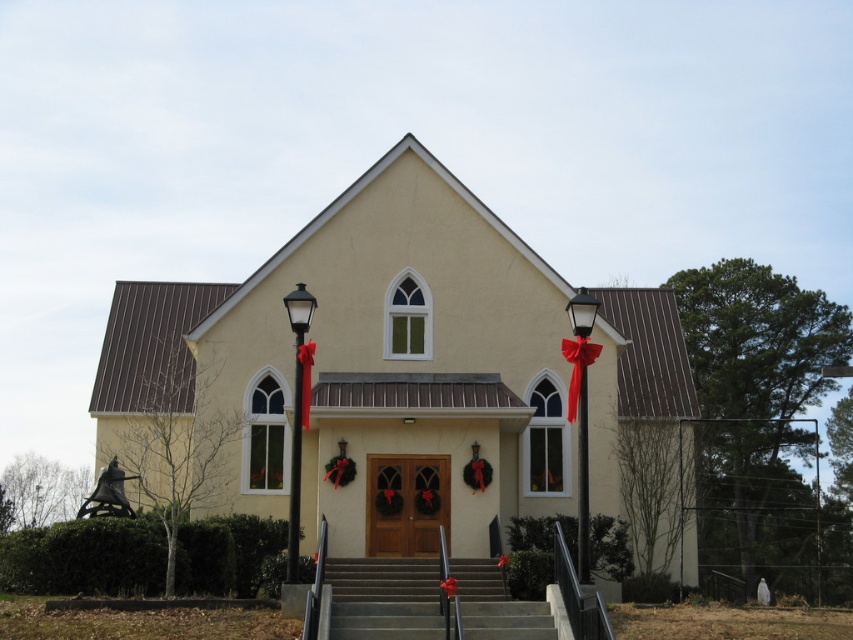
You are a visitor approaching the yellow matte church at center and need to walk up the smooth concrete stairs at center. Can you estimate whether the church is wider than the stairs?

The yellow matte church at center is wider than the smooth concrete stairs at center because its width surpasses that of the stairs.

You are standing at the bottom of the smooth concrete stairs at center, facing the yellow matte church at center. Which object is closer to you?

The yellow matte church at center is closer to you because it is further to the viewer than the smooth concrete stairs at center, meaning the church appears nearer in the image.